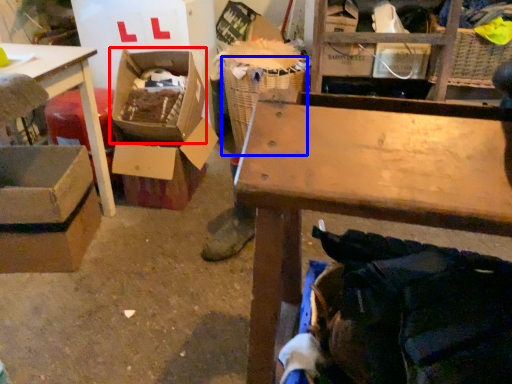
Question: Which object appears farthest to the camera in this image, storage box (highlighted by a red box) or laundry basket (highlighted by a blue box)?

Choices:
 (A) storage box
 (B) laundry basket

Answer: (B)